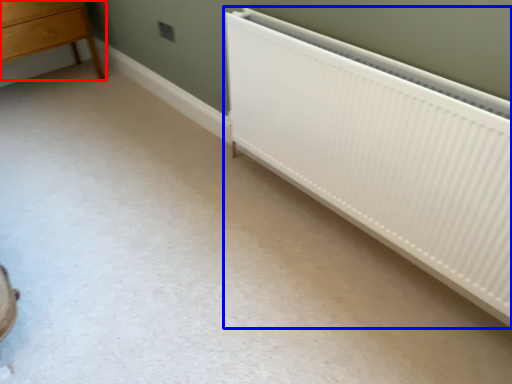
Question: Among these objects, which one is farthest to the camera, chest of drawers (highlighted by a red box) or radiator (highlighted by a blue box)?

Choices:
 (A) chest of drawers
 (B) radiator

Answer: (A)